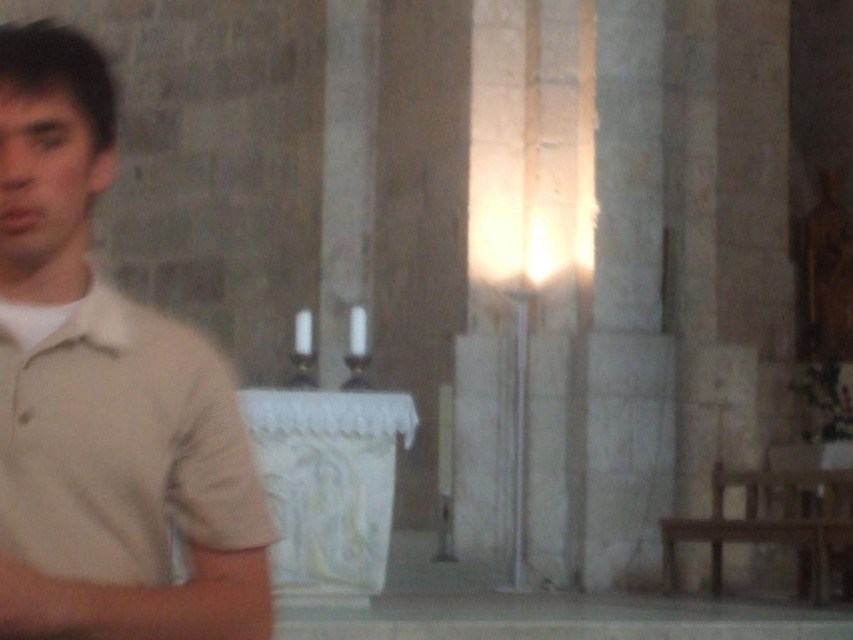
Question: Is beige cotton shirt at left below wooden bench at lower right?

Choices:
 (A) no
 (B) yes

Answer: (A)

Question: Which point is farther to the camera?

Choices:
 (A) beige cotton shirt at left
 (B) wooden bench at lower right

Answer: (B)

Question: Which object is closer to the camera taking this photo?

Choices:
 (A) wooden bench at lower right
 (B) beige cotton shirt at left

Answer: (B)

Question: Observing the image, what is the correct spatial positioning of beige cotton shirt at left in reference to wooden bench at lower right?

Choices:
 (A) above
 (B) below

Answer: (A)

Question: Does beige cotton shirt at left appear under wooden bench at lower right?

Choices:
 (A) no
 (B) yes

Answer: (A)